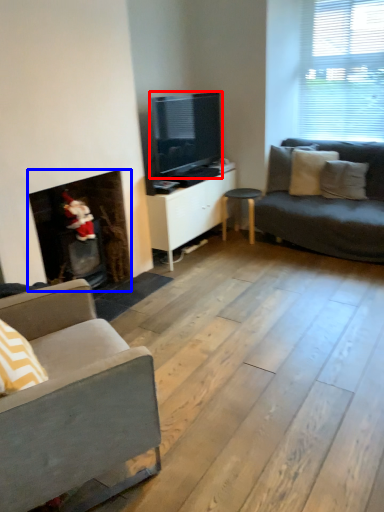
Question: Which point is further to the camera, television (highlighted by a red box) or fireplace (highlighted by a blue box)?

Choices:
 (A) television
 (B) fireplace

Answer: (A)